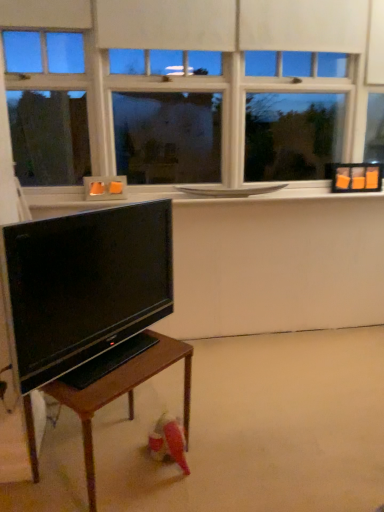
Locate an element on the screen. free space to the right of wooden table at lower left is located at coordinates (225, 466).